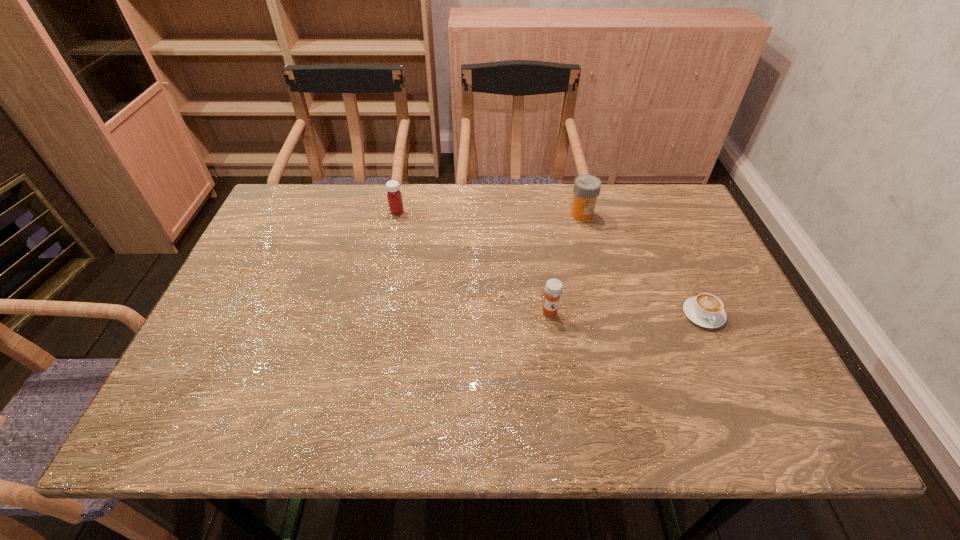
Where is `object located in the right edge section of the desktop`? This screenshot has height=540, width=960. object located in the right edge section of the desktop is located at coordinates (706, 310).

Find the location of `free space at the far edge`. free space at the far edge is located at coordinates (459, 186).

You are a GUI agent. You are given a task and a screenshot of the screen. Output one action in this format:
    pyautogui.click(x=<x>, y=<y>)
    Task: Click on the vacant area at the near edge of the desktop
    This screenshot has width=960, height=540.
    Given the screenshot: What is the action you would take?
    pyautogui.click(x=711, y=438)

You are a GUI agent. You are given a task and a screenshot of the screen. Output one action in this format:
    pyautogui.click(x=<x>, y=<y>)
    Task: Click on the free space at the left edge of the desktop
    This screenshot has height=540, width=960.
    Given the screenshot: What is the action you would take?
    pyautogui.click(x=250, y=293)

Image resolution: width=960 pixels, height=540 pixels. In the image, there is a desktop. Find the location of `free space at the far left corner`. free space at the far left corner is located at coordinates (294, 190).

At what (x,y) coordinates should I click in order to perform the action: click on free spot at the far right corner of the desktop. Please return your answer as a coordinate pair (x, y). Image resolution: width=960 pixels, height=540 pixels. Looking at the image, I should click on (699, 233).

You are a GUI agent. You are given a task and a screenshot of the screen. Output one action in this format:
    pyautogui.click(x=<x>, y=<y>)
    Task: Click on the free point between the second medicine from left to right and the leftmost medicine
    The image size is (960, 540).
    Given the screenshot: What is the action you would take?
    pyautogui.click(x=473, y=262)

The width and height of the screenshot is (960, 540). I want to click on vacant region between the cappuccino and the rightmost medicine, so click(x=642, y=264).

Where is `unoccupied area between the leftmost medicine and the second medicine from right to left`? This screenshot has width=960, height=540. unoccupied area between the leftmost medicine and the second medicine from right to left is located at coordinates (473, 262).

Identify the location of vacant area that lies between the third object from right to left and the cappuccino. This screenshot has height=540, width=960. (627, 313).